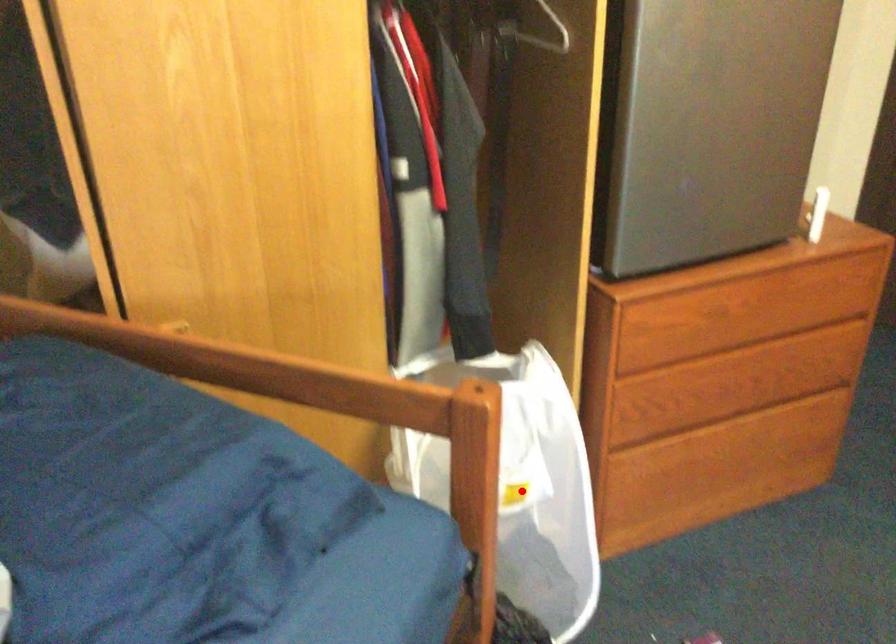
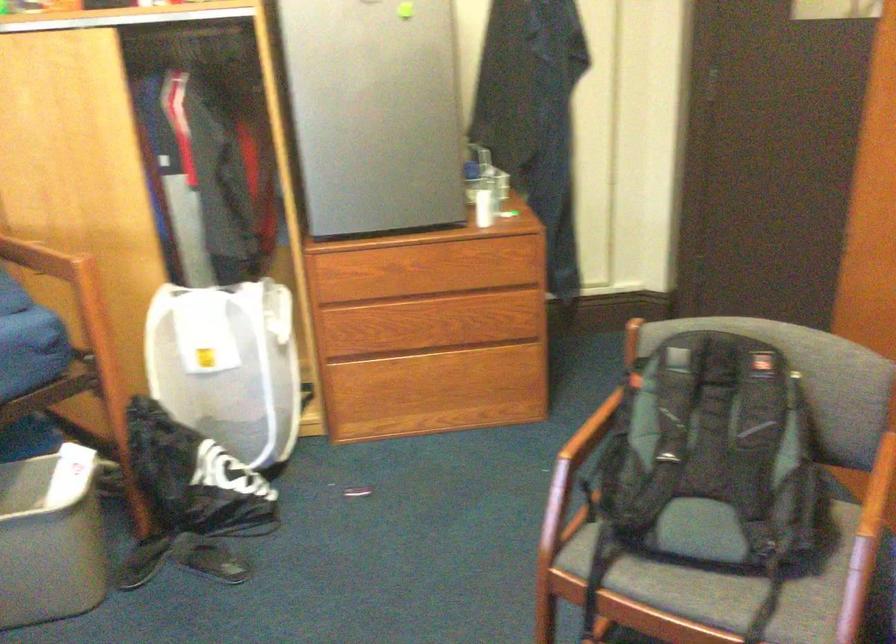
In the second image, find the point that corresponds to the highlighted location in the first image.

(228, 365)